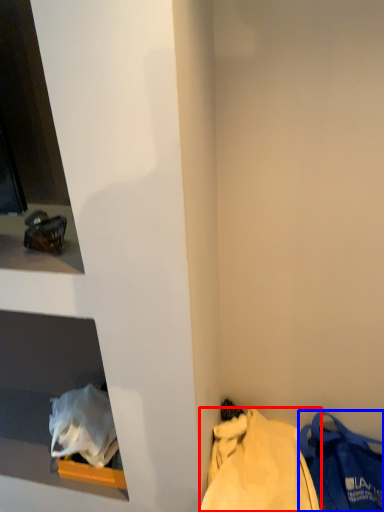
Question: Which object is further to the camera taking this photo, tote bag (highlighted by a red box) or handbag (highlighted by a blue box)?

Choices:
 (A) tote bag
 (B) handbag

Answer: (B)